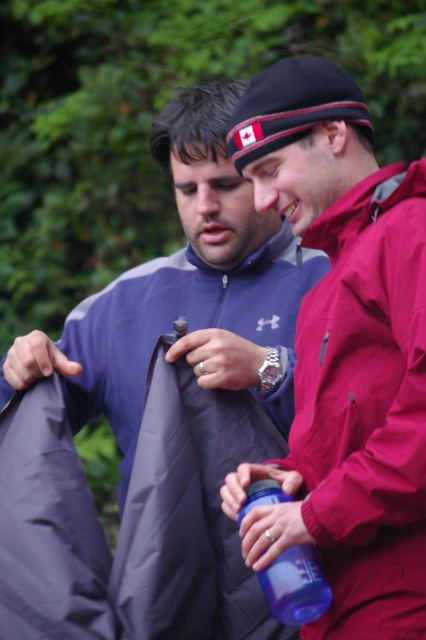
Question: Is the position of matte blue jacket at center less distant than that of matte red jacket at right?

Choices:
 (A) yes
 (B) no

Answer: (B)

Question: Does matte blue jacket at center appear under blue plastic water bottle at center?

Choices:
 (A) no
 (B) yes

Answer: (A)

Question: Which object is the closest to the matte red jacket at right?

Choices:
 (A) blue plastic water bottle at center
 (B) matte blue jacket at center

Answer: (A)

Question: Which object appears closest to the camera in this image?

Choices:
 (A) matte red jacket at right
 (B) matte blue jacket at center
 (C) blue plastic water bottle at center

Answer: (A)

Question: Which object appears closest to the camera in this image?

Choices:
 (A) matte blue jacket at center
 (B) matte red jacket at right

Answer: (B)

Question: Does matte red jacket at right appear on the left side of blue plastic water bottle at center?

Choices:
 (A) no
 (B) yes

Answer: (A)